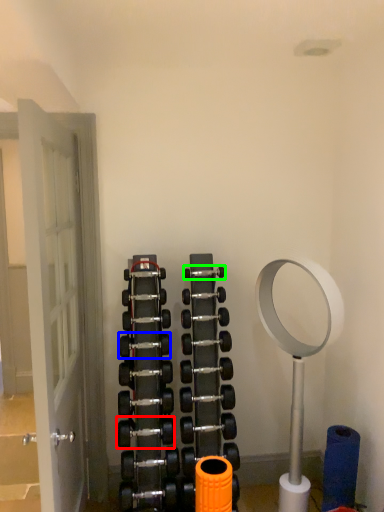
Question: Which is nearer to the dumbbell (highlighted by a red box)? dumbbell (highlighted by a blue box) or dumbbell (highlighted by a green box).

Choices:
 (A) dumbbell
 (B) dumbbell

Answer: (A)